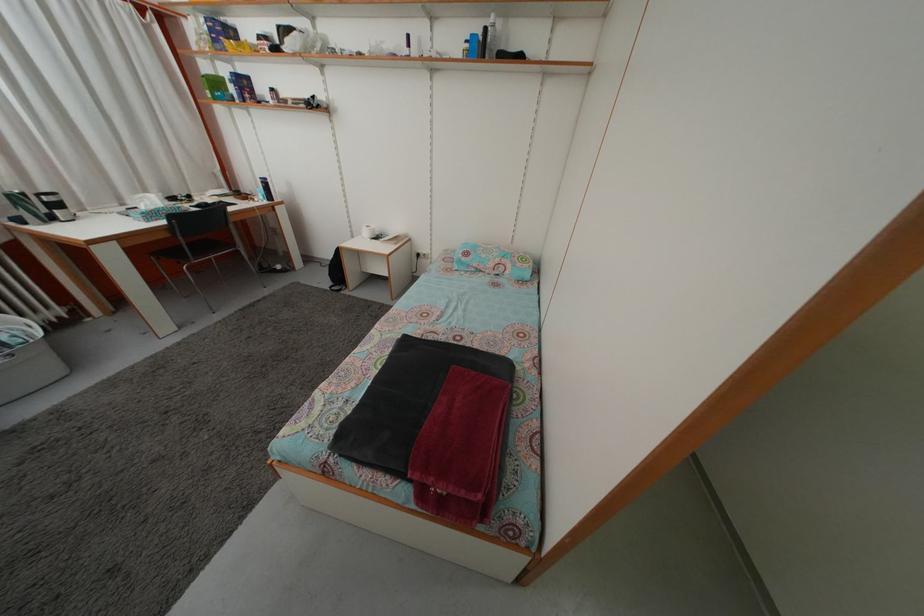
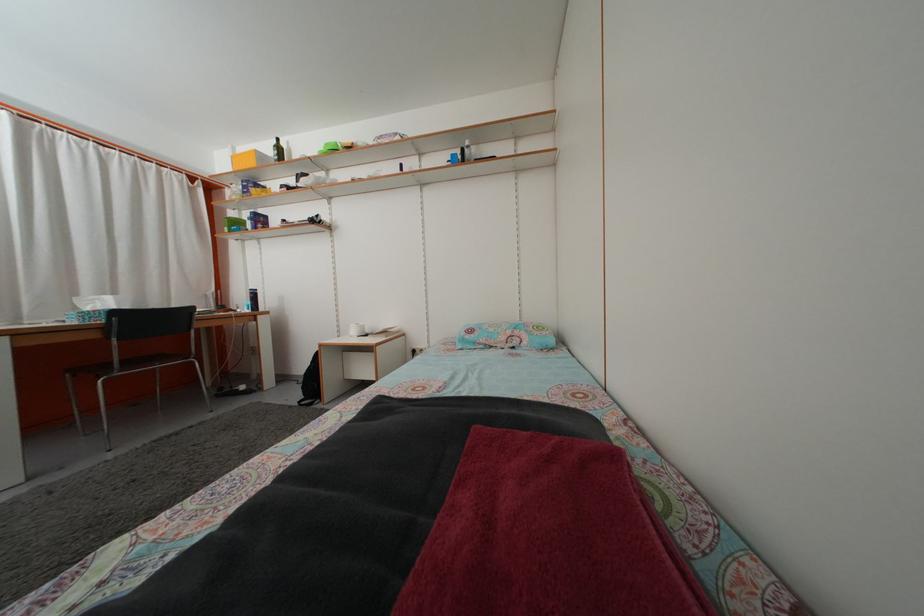
Question: How did the camera likely rotate?

Choices:
 (A) Left
 (B) Right
 (C) Up
 (D) Down

Answer: (C)